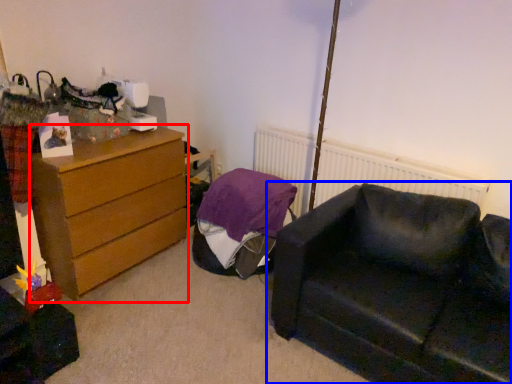
Question: Which point is closer to the camera, chest of drawers (highlighted by a red box) or studio couch (highlighted by a blue box)?

Choices:
 (A) chest of drawers
 (B) studio couch

Answer: (B)